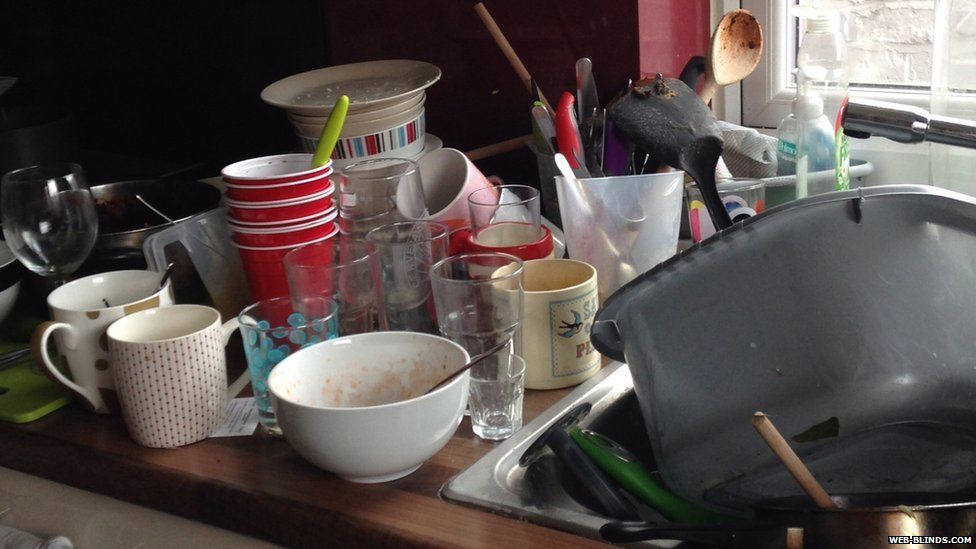
Locate an element on the screen. Image resolution: width=976 pixels, height=549 pixels. red solo cups is located at coordinates (310, 232), (258, 264), (272, 212), (273, 193), (247, 181), (272, 223).